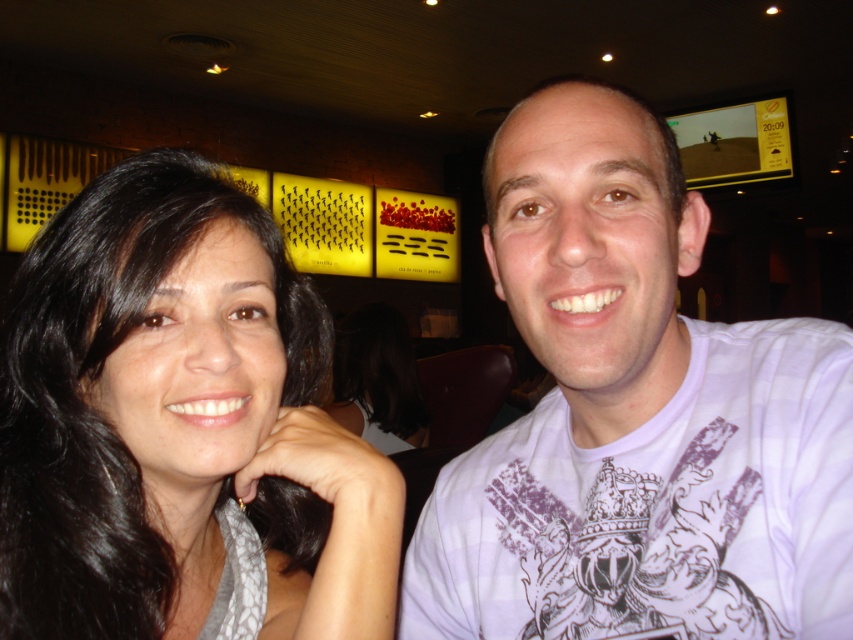
Consider the image. Between white printed t-shirt at center and black hair at left, which one appears on the right side from the viewer's perspective?

white printed t-shirt at center

Does point (587, 420) lie behind point (387, 509)?

Yes, point (587, 420) is behind point (387, 509).

You are a GUI agent. You are given a task and a screenshot of the screen. Output one action in this format:
    pyautogui.click(x=<x>, y=<y>)
    Task: Click on the white printed t-shirt at center
    
    Given the screenshot: What is the action you would take?
    pyautogui.click(x=635, y=417)